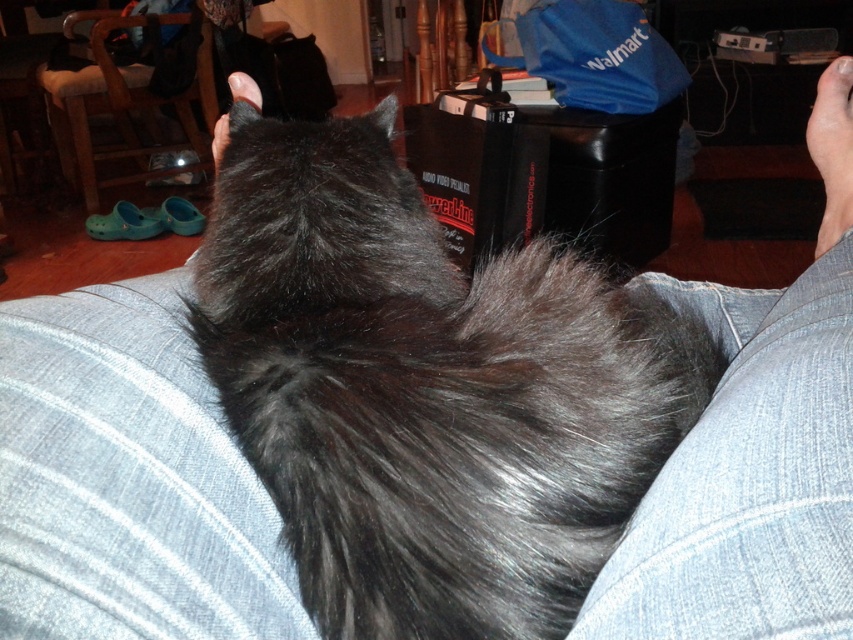
You are a photographer trying to capture the fluffy black cat at center and the fuzzy fur at center in a single frame. Since the camera can only focus on objects wider than 10 inches, can both subjects be captured clearly?

The fluffy black cat at center is wider than the fuzzy fur at center. Since the camera requires objects wider than 10 inches to focus, both can be captured if the cat meets the width requirement. However, the exact width of the cat isn

You are a tailor measuring fabrics for a project. You have a piece of fabric that is 10 cm thick. You need to choose between the fuzzy fur at center and the denim at lower right. Which fabric is thinner and suitable for your project?

The fuzzy fur at center is thinner than the denim at lower right, so it is suitable for the project.